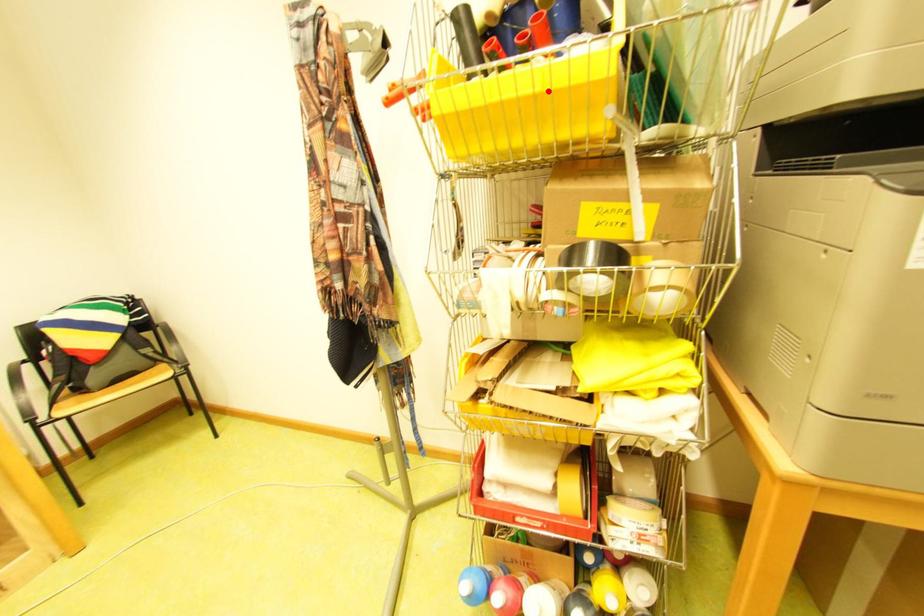
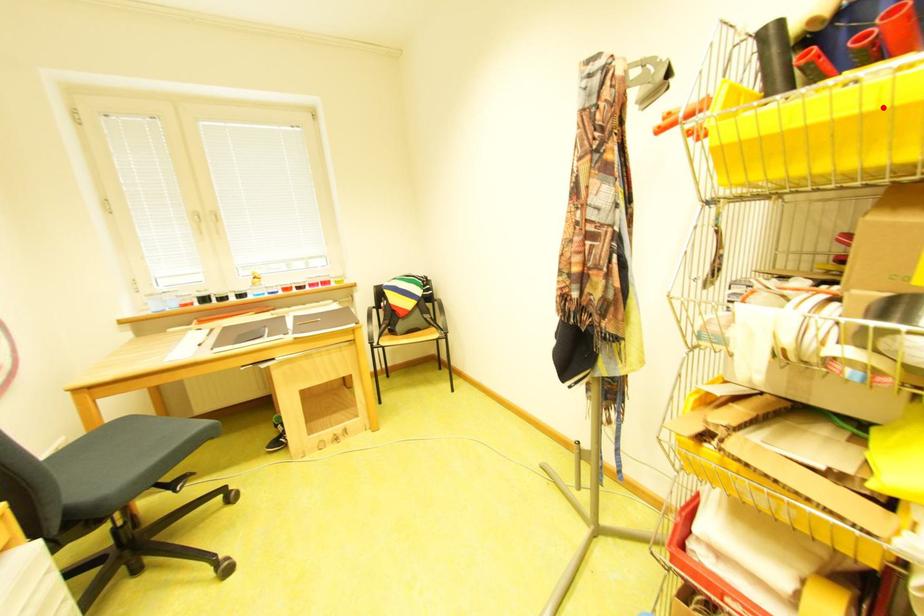
I am providing you with two images of the same scene from different viewpoints. A red point is marked on the first image and another point is marked on the second image. Do the highlighted points in image1 and image2 indicate the same real-world spot?

Yes